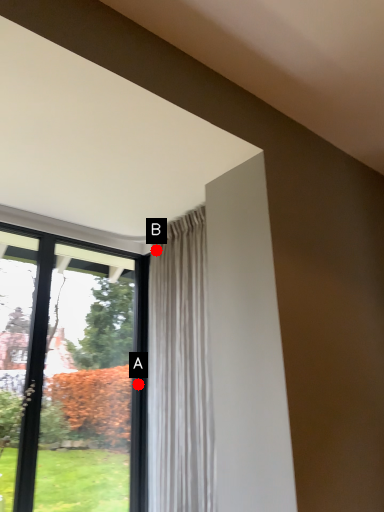
Question: Two points are circled on the image, labeled by A and B beside each circle. Which point is further to the camera?

Choices:
 (A) A is further
 (B) B is further

Answer: (B)